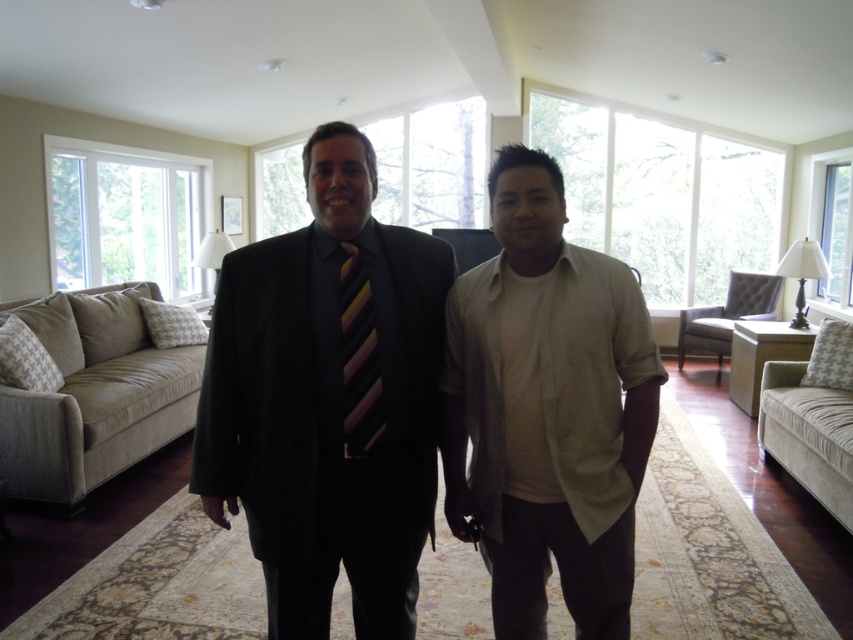
You are a photographer setting up a shoot in this living room. You need to position a spotlight to the right of both the matte black suit at center and the light beige cotton shirt at center. Is there enough space between them to place the spotlight?

The matte black suit at center is to the left of the light beige cotton shirt at center, so there is space between them to place the spotlight to the right of both.

You are a photographer setting up a shoot in this living room. You need to position a spotlight so that it illuminates both the matte black suit at center and the light beige cotton shirt at center equally. Given their positions, where should you place the spotlight relative to the two objects?

The matte black suit at center is located below the light beige cotton shirt at center. To illuminate both equally, the spotlight should be placed above the light beige cotton shirt at center so that the light can reach both objects, casting the matte black suit at center in a shadow if not adjusted properly. However, since the question specifies equal illumination, positioning the spotlight directly above the midpoint between the two objects would ensure both receive adequate light.